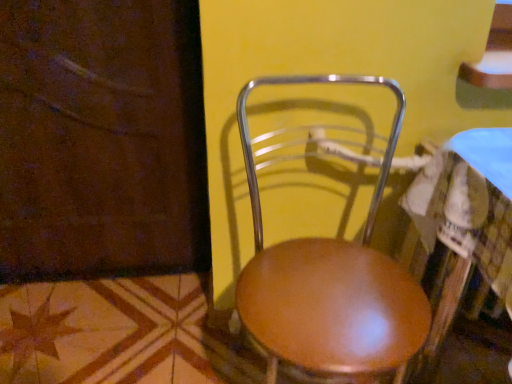
Question: Is brown wood screen door at lower left looking in the opposite direction of shiny brown table at center?

Choices:
 (A) no
 (B) yes

Answer: (A)

Question: Is brown wood screen door at lower left at the left side of shiny brown table at center?

Choices:
 (A) yes
 (B) no

Answer: (A)

Question: Is shiny brown table at center a part of brown wood screen door at lower left?

Choices:
 (A) yes
 (B) no

Answer: (B)

Question: Is brown wood screen door at lower left facing towards shiny brown table at center?

Choices:
 (A) no
 (B) yes

Answer: (A)

Question: Is the position of brown wood screen door at lower left more distant than that of shiny brown table at center?

Choices:
 (A) no
 (B) yes

Answer: (B)

Question: Which is correct: wooden seat at center is inside shiny brown table at center, or outside of it?

Choices:
 (A) inside
 (B) outside

Answer: (B)

Question: In the image, is wooden seat at center positioned in front of or behind shiny brown table at center?

Choices:
 (A) behind
 (B) front

Answer: (A)

Question: Considering the positions of wooden seat at center and shiny brown table at center in the image, is wooden seat at center bigger or smaller than shiny brown table at center?

Choices:
 (A) big
 (B) small

Answer: (B)

Question: Considering the positions of wooden seat at center and shiny brown table at center in the image, is wooden seat at center taller or shorter than shiny brown table at center?

Choices:
 (A) tall
 (B) short

Answer: (A)

Question: Is point 478,160 positioned closer to the camera than point 78,120?

Choices:
 (A) closer
 (B) farther

Answer: (A)

Question: From their relative heights in the image, would you say shiny brown table at center is taller or shorter than brown wood screen door at lower left?

Choices:
 (A) tall
 (B) short

Answer: (B)

Question: Is shiny brown table at center situated inside brown wood screen door at lower left or outside?

Choices:
 (A) inside
 (B) outside

Answer: (B)

Question: From the image's perspective, relative to brown wood screen door at lower left, is shiny brown table at center above or below?

Choices:
 (A) above
 (B) below

Answer: (B)

Question: Choose the correct answer: Is wooden seat at center inside brown wood screen door at lower left or outside it?

Choices:
 (A) outside
 (B) inside

Answer: (A)

Question: Considering the positions of wooden seat at center and brown wood screen door at lower left in the image, is wooden seat at center bigger or smaller than brown wood screen door at lower left?

Choices:
 (A) big
 (B) small

Answer: (A)